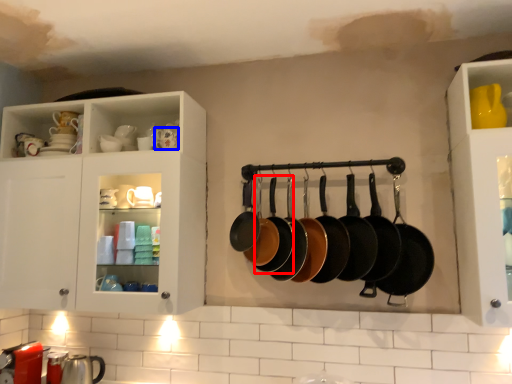
Question: Which object is closer to the camera taking this photo, frying pan (highlighted by a red box) or tableware (highlighted by a blue box)?

Choices:
 (A) frying pan
 (B) tableware

Answer: (A)